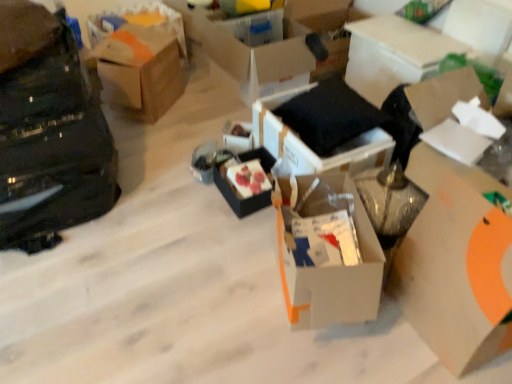
I want to click on free space in front of black matte bag at left, so click(x=71, y=291).